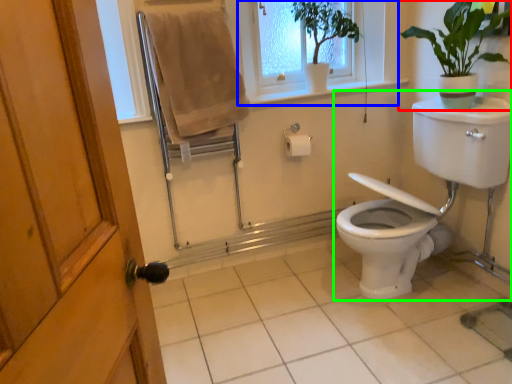
Question: Which is farther away from houseplant (highlighted by a red box)? window frame (highlighted by a blue box) or sink (highlighted by a green box)?

Choices:
 (A) window frame
 (B) sink

Answer: (A)